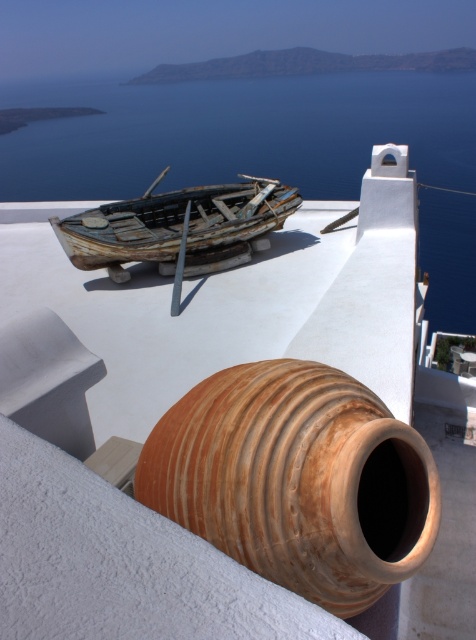
Between brown clay pot at center and rusty wood boat at center, which one appears on the right side from the viewer's perspective?

brown clay pot at center

Does brown clay pot at center have a smaller size compared to rusty wood boat at center?

Yes.

Is point (289, 573) closer to camera compared to point (107, 205)?

Yes, it is.

Identify the location of brown clay pot at center. Image resolution: width=476 pixels, height=640 pixels. (297, 480).

Which is in front, point (23, 150) or point (255, 220)?

Point (255, 220) is in front.

Does blue water at upper center appear over rusty wood boat at center?

Yes.

Where is `blue water at upper center`? This screenshot has height=640, width=476. blue water at upper center is located at coordinates (238, 132).

Is blue water at upper center above brown clay pot at center?

Yes.

Who is positioned more to the right, blue water at upper center or brown clay pot at center?

brown clay pot at center is more to the right.

Is point (39, 196) farther from viewer compared to point (287, 406)?

Yes, point (39, 196) is behind point (287, 406).

Where is `blue water at upper center`? The image size is (476, 640). blue water at upper center is located at coordinates (238, 132).